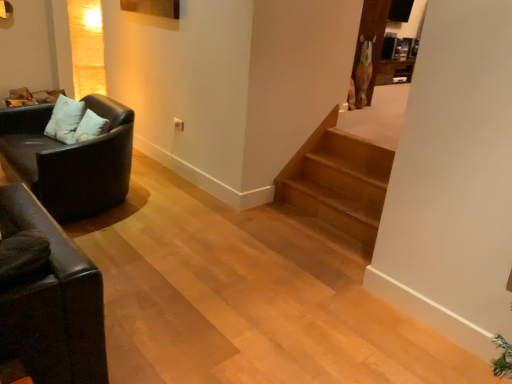
In order to face matte black couch at left, should I rotate leftwards or rightwards?

You should look left and rotate roughly 23.612 degrees.

Find the location of a particular element. This screenshot has width=512, height=384. matte black couch at left is located at coordinates (70, 159).

Locate an element on the screen. The image size is (512, 384). light brown wooden stairs at center is located at coordinates (339, 184).

This screenshot has width=512, height=384. Identify the location of matte black couch at left. (70, 159).

Looking at this image, which is behind, light brown wooden stairs at center or white soft pillow at left?

white soft pillow at left.

Considering the relative positions of light brown wooden stairs at center and white soft pillow at left in the image provided, is light brown wooden stairs at center to the left or to the right of white soft pillow at left?

Clearly, light brown wooden stairs at center is on the right of white soft pillow at left in the image.

In terms of width, does light brown wooden stairs at center look wider or thinner when compared to white soft pillow at left?

In the image, light brown wooden stairs at center appears to be wider than white soft pillow at left.

Considering the relative positions of matte black couch at left and light brown wooden stairs at center in the image provided, is matte black couch at left to the left of light brown wooden stairs at center from the viewer's perspective?

Yes.

Is matte black couch at left aimed at light brown wooden stairs at center?

No.

Which object is thinner, matte black couch at left or light brown wooden stairs at center?

light brown wooden stairs at center.

Can you confirm if light brown wooden stairs at center is taller than matte black couch at left?

No, light brown wooden stairs at center is not taller than matte black couch at left.

Does point (316, 140) come farther from viewer compared to point (8, 116)?

Yes, point (316, 140) is farther from viewer.

Is light brown wooden stairs at center bigger or smaller than matte black couch at left?

Considering their sizes, light brown wooden stairs at center takes up less space than matte black couch at left.

Does white soft pillow at left have a greater width compared to light brown wooden stairs at center?

No.

From the image's perspective, between white soft pillow at left and light brown wooden stairs at center, who is located below?

light brown wooden stairs at center is shown below in the image.

The height and width of the screenshot is (384, 512). Identify the location of stairs located in front of the white soft pillow at left. (339, 184).

From a real-world perspective, is white soft pillow at left over matte black couch at left?

Yes, from a real-world perspective, white soft pillow at left is over matte black couch at left

Would you say white soft pillow at left is a long distance from matte black couch at left?

white soft pillow at left is actually quite close to matte black couch at left.

Can you confirm if white soft pillow at left is taller than matte black couch at left?

No, white soft pillow at left is not taller than matte black couch at left.

Considering the relative positions of white soft pillow at left and matte black couch at left in the image provided, is white soft pillow at left behind matte black couch at left?

That is True.

Does matte black couch at left contain white soft pillow at left?

Absolutely, white soft pillow at left is inside matte black couch at left.

Which of these two, matte black couch at left or white soft pillow at left, is smaller?

white soft pillow at left.

Are matte black couch at left and white soft pillow at left far apart?

matte black couch at left is near white soft pillow at left, not far away.

Where is `stairs that is in front of the white soft pillow at left`? The width and height of the screenshot is (512, 384). stairs that is in front of the white soft pillow at left is located at coordinates (339, 184).

Identify the location of studio couch above the light brown wooden stairs at center (from a real-world perspective). The width and height of the screenshot is (512, 384). (70, 159).

In the scene shown: Based on their spatial positions, is matte black couch at left or light brown wooden stairs at center further from white soft pillow at left?

light brown wooden stairs at center is positioned further to the anchor white soft pillow at left.

Which object lies further to the anchor point light brown wooden stairs at center, white soft pillow at left or matte black couch at left?

The object further to light brown wooden stairs at center is white soft pillow at left.

Based on their spatial positions, is white soft pillow at left or light brown wooden stairs at center further from matte black couch at left?

light brown wooden stairs at center is positioned further to the anchor matte black couch at left.

Looking at the image, which one is located closer to matte black couch at left, light brown wooden stairs at center or white soft pillow at left?

white soft pillow at left lies closer to matte black couch at left than the other object.

When comparing their distances from white soft pillow at left, does light brown wooden stairs at center or matte black couch at left seem closer?

Among the two, matte black couch at left is located nearer to white soft pillow at left.

From the image, which object appears to be nearer to light brown wooden stairs at center, matte black couch at left or white soft pillow at left?

Based on the image, matte black couch at left appears to be nearer to light brown wooden stairs at center.

Where is `studio couch between white soft pillow at left and light brown wooden stairs at center from left to right`? This screenshot has height=384, width=512. studio couch between white soft pillow at left and light brown wooden stairs at center from left to right is located at coordinates (70, 159).